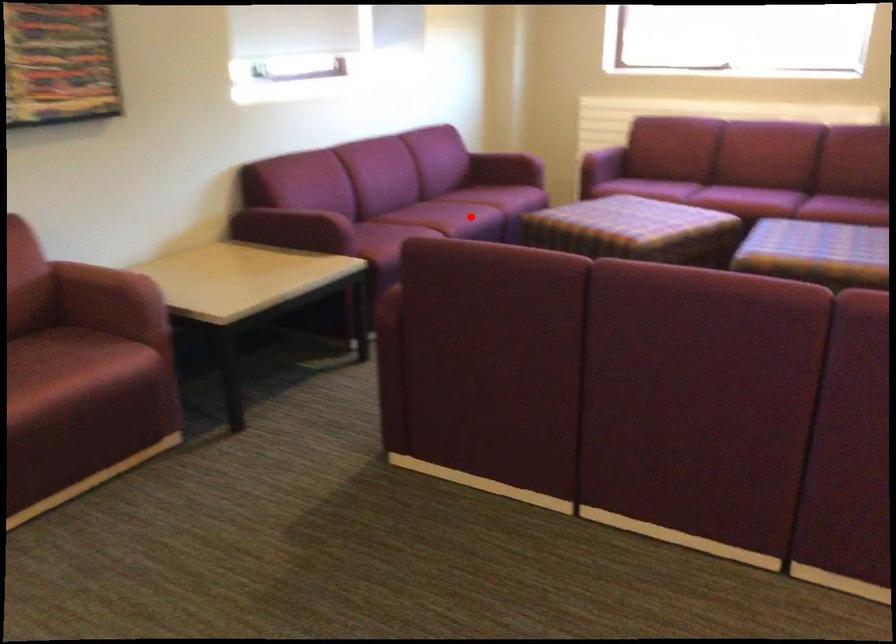
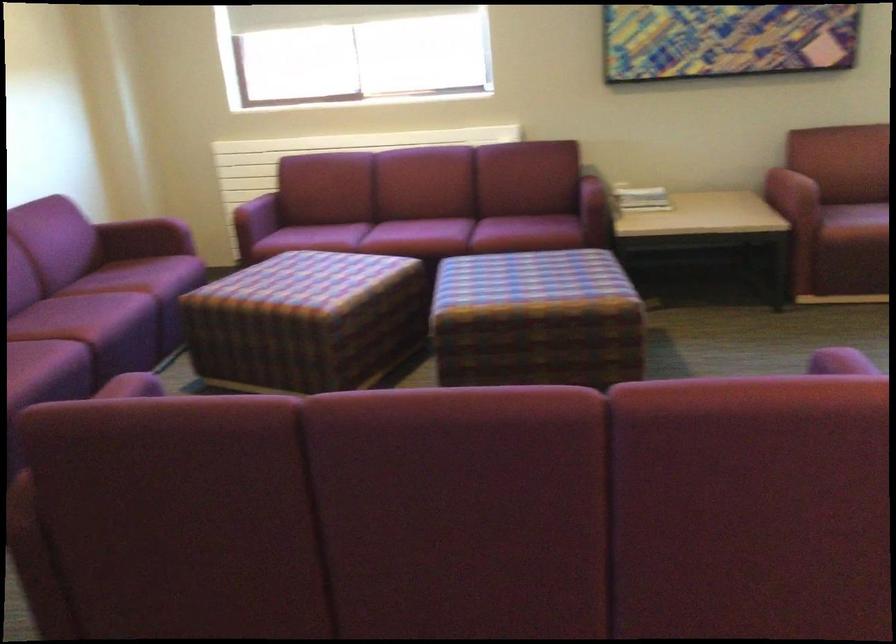
Find the pixel in the second image that matches the highlighted location in the first image.

(116, 313)